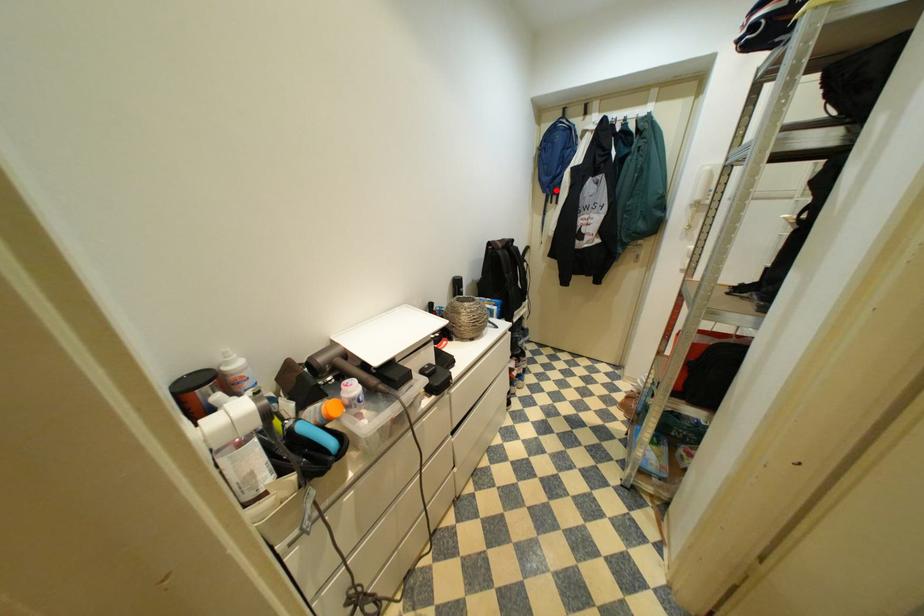
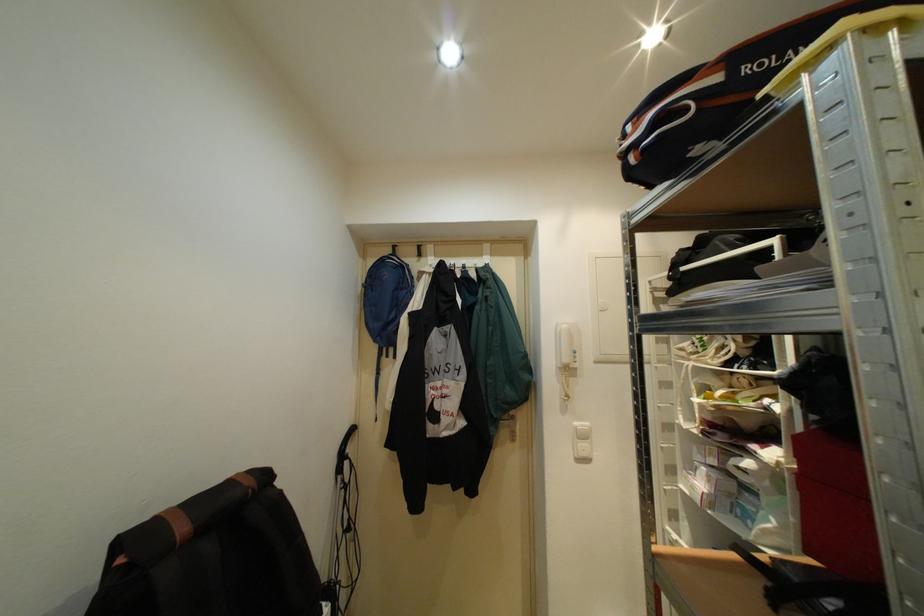
In the second image, find the point that corresponds to the highlighted location in the first image.

(387, 339)